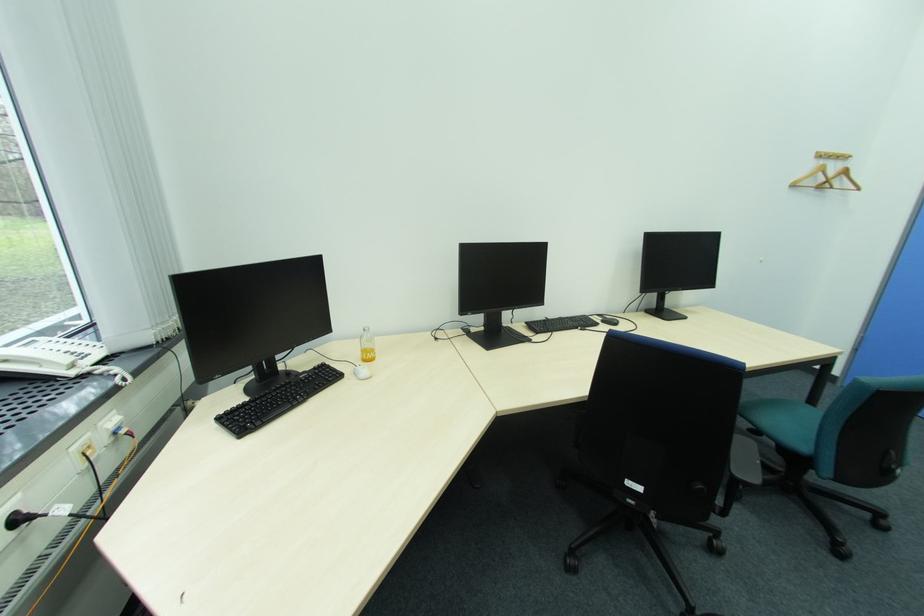
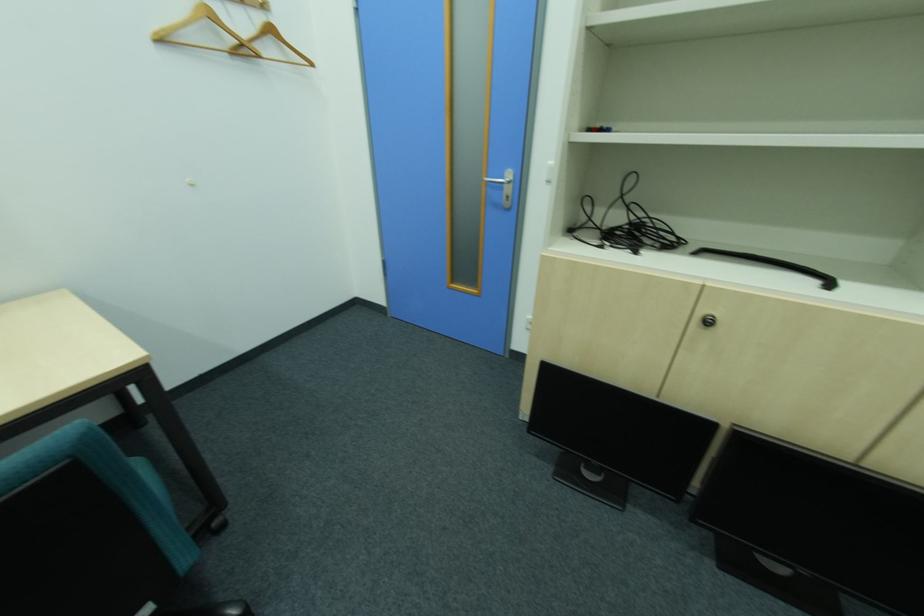
Where in the second image is the point corresponding to point (832, 183) from the first image?

(249, 45)